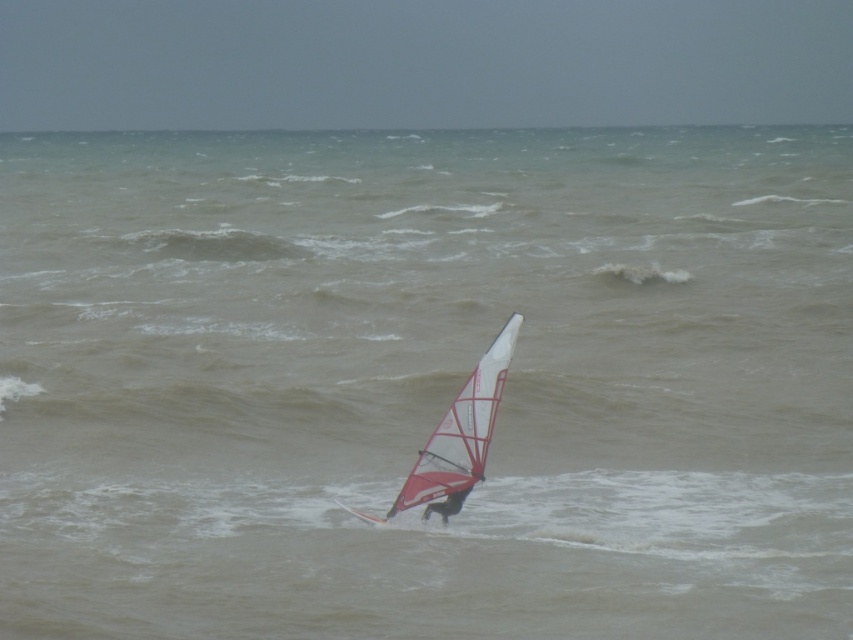
Question: Considering the relative positions of white matte sail at center and black fabric windsurfer at center in the image provided, where is white matte sail at center located with respect to black fabric windsurfer at center?

Choices:
 (A) below
 (B) above

Answer: (B)

Question: Among these points, which one is nearest to the camera?

Choices:
 (A) (461, 468)
 (B) (457, 509)

Answer: (A)

Question: Is white matte sail at center below black fabric windsurfer at center?

Choices:
 (A) yes
 (B) no

Answer: (B)

Question: Among these objects, which one is farthest from the camera?

Choices:
 (A) white matte sail at center
 (B) black fabric windsurfer at center

Answer: (B)

Question: Is white matte sail at center below black fabric windsurfer at center?

Choices:
 (A) no
 (B) yes

Answer: (A)